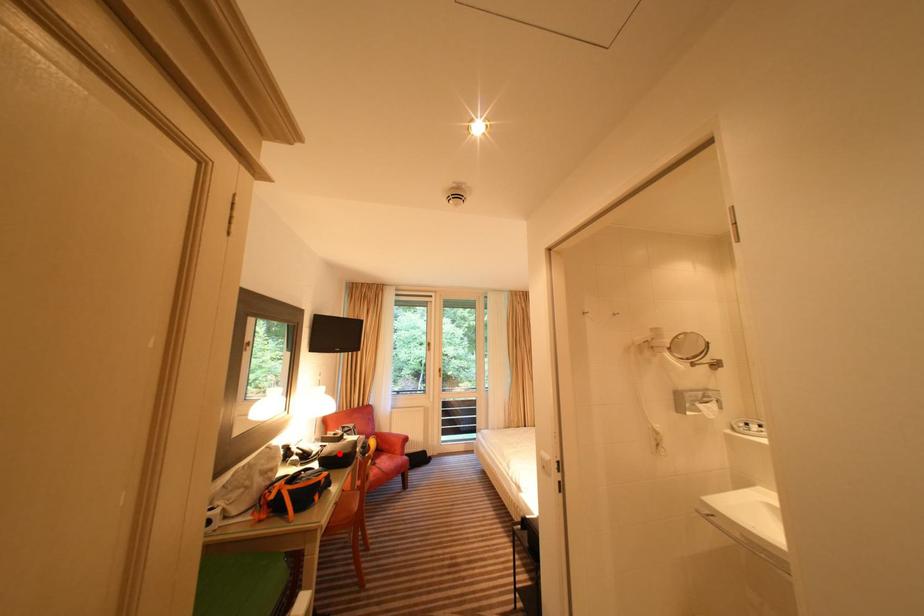
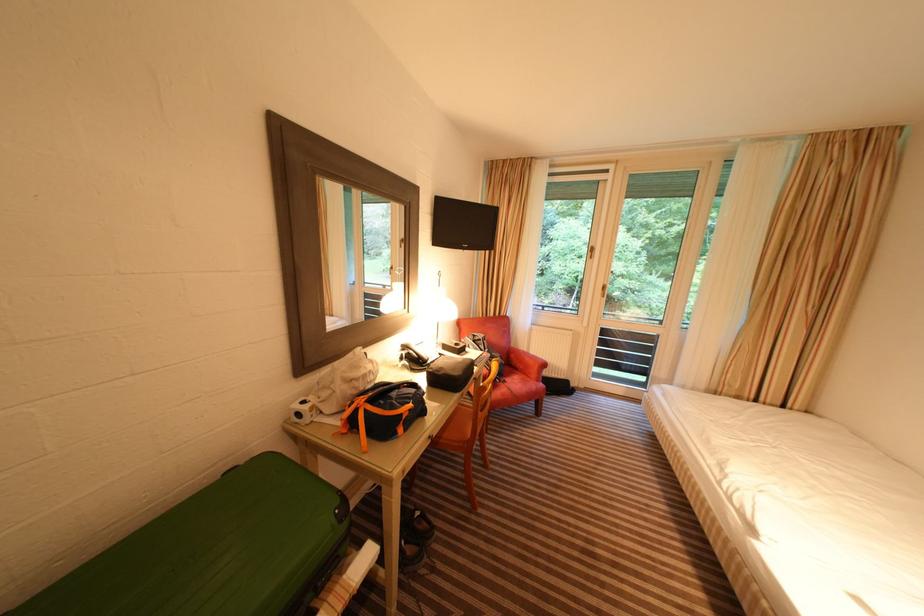
Question: I am providing you with two images of the same scene from different viewpoints. In image1, a red point is highlighted. Considering the same 3D point in image2, which of the following is correct?

Choices:
 (A) It is closer
 (B) It is farther

Answer: (B)